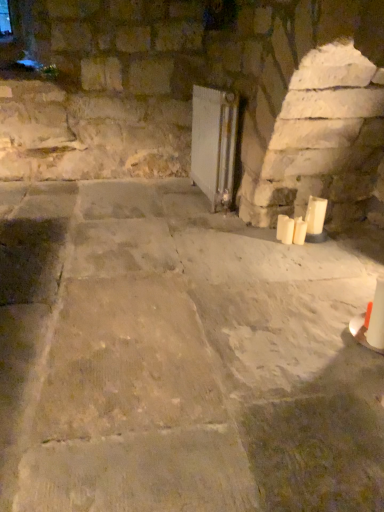
Question: Can you confirm if white matte candle at lower right, the second candle positioned from the right, is shorter than white glossy radiator at center?

Choices:
 (A) no
 (B) yes

Answer: (B)

Question: From the image's perspective, is white matte candle at lower right, the second candle in the left-to-right sequence, on white glossy radiator at center?

Choices:
 (A) yes
 (B) no

Answer: (B)

Question: Does white matte candle at lower right, the second candle positioned from the right, touch white glossy radiator at center?

Choices:
 (A) no
 (B) yes

Answer: (A)

Question: Is white matte candle at lower right, the second candle in the left-to-right sequence, taller than white glossy radiator at center?

Choices:
 (A) yes
 (B) no

Answer: (B)

Question: From a real-world perspective, is white matte candle at lower right, the second candle in the left-to-right sequence, below white glossy radiator at center?

Choices:
 (A) yes
 (B) no

Answer: (A)

Question: From the image's perspective, is white matte candle at right, which is counted as the third candle, starting from the left, above or below white glossy radiator at center?

Choices:
 (A) below
 (B) above

Answer: (A)

Question: From a real-world perspective, is white matte candle at right, the first candle when ordered from right to left, physically located above or below white glossy radiator at center?

Choices:
 (A) above
 (B) below

Answer: (B)

Question: Visually, is white matte candle at right, the first candle when ordered from right to left, positioned to the left or to the right of white glossy radiator at center?

Choices:
 (A) left
 (B) right

Answer: (B)

Question: Does point (317, 225) appear closer or farther from the camera than point (200, 108)?

Choices:
 (A) closer
 (B) farther

Answer: (A)

Question: Considering their positions, is white matte candle at right, which is the 1th candle from left to right, located in front of or behind white matte candle at lower right, the second candle in the left-to-right sequence?

Choices:
 (A) front
 (B) behind

Answer: (A)

Question: Is white matte candle at right, which is the 1th candle from left to right, inside the boundaries of white matte candle at lower right, the second candle positioned from the right, or outside?

Choices:
 (A) outside
 (B) inside

Answer: (A)

Question: Is white matte candle at right, which is the 1th candle from left to right, bigger or smaller than white matte candle at lower right, the second candle in the left-to-right sequence?

Choices:
 (A) big
 (B) small

Answer: (B)

Question: From the image's perspective, relative to white matte candle at lower right, the second candle in the left-to-right sequence, is white matte candle at right, which is the 1th candle from left to right, above or below?

Choices:
 (A) below
 (B) above

Answer: (B)

Question: Considering the positions of point (299, 225) and point (291, 222), is point (299, 225) closer or farther from the camera than point (291, 222)?

Choices:
 (A) closer
 (B) farther

Answer: (A)

Question: Based on their sizes in the image, would you say white matte candle at lower right, the second candle in the left-to-right sequence, is bigger or smaller than white matte candle at right, the third candle positioned from the right?

Choices:
 (A) small
 (B) big

Answer: (B)